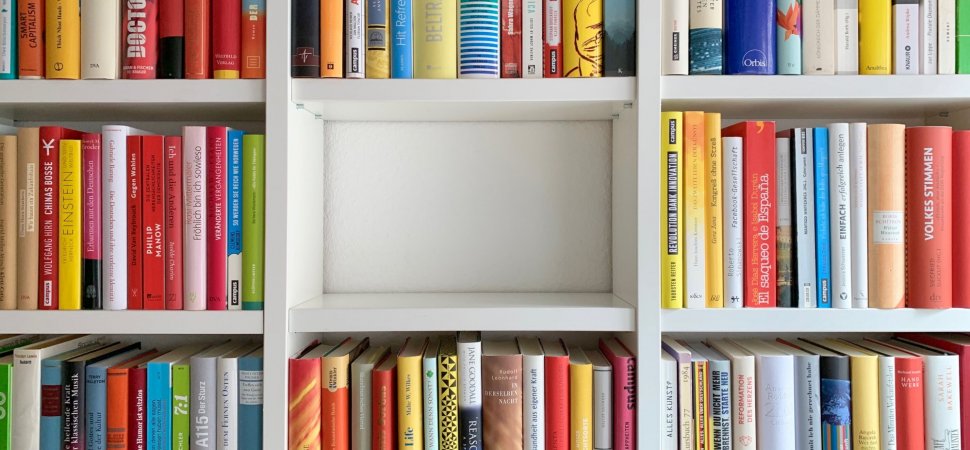
Find the location of a particular element. This screenshot has width=970, height=450. white shelf is located at coordinates (361, 94), (97, 94), (707, 92), (192, 329), (397, 319), (765, 311).